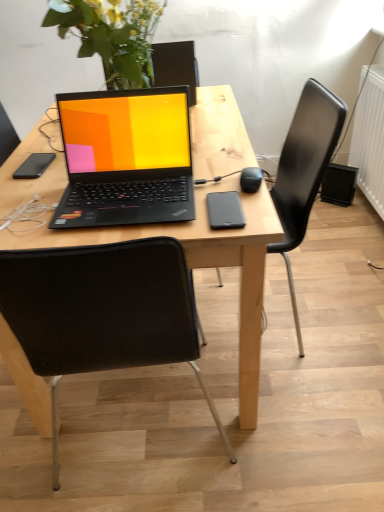
This screenshot has width=384, height=512. Identify the location of empty space that is in between black matte phone at center, which appears as the 1th mobile phone when viewed from the front, and black matte laptop at center. (186, 224).